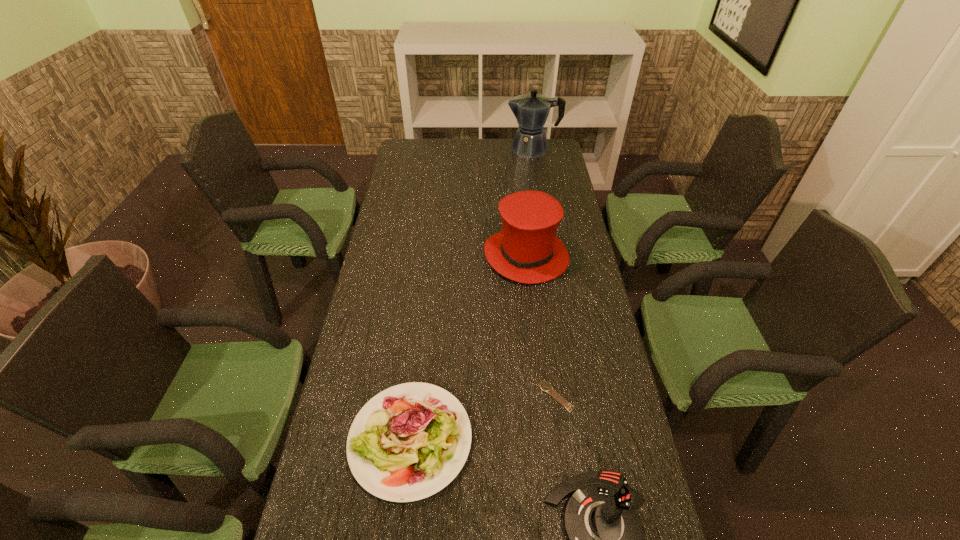
Locate an element on the screen. Image resolution: width=960 pixels, height=540 pixels. free space located on the back of the leftmost object is located at coordinates (420, 364).

Identify the location of vacant space positioned on the front of the watch. click(568, 491).

Where is `object present at the far edge`? object present at the far edge is located at coordinates (531, 110).

Image resolution: width=960 pixels, height=540 pixels. In order to click on object present at the left edge in this screenshot , I will do `click(408, 442)`.

Find the location of `coffeepot present at the right edge`. coffeepot present at the right edge is located at coordinates (531, 110).

Find the location of a particular element. The image size is (960, 540). hat that is at the right edge is located at coordinates (527, 250).

At what (x,y) coordinates should I click in order to perform the action: click on watch situated at the right edge. Please return your answer as a coordinate pair (x, y). This screenshot has width=960, height=540. Looking at the image, I should click on (545, 386).

Image resolution: width=960 pixels, height=540 pixels. I want to click on object at the far right corner, so click(531, 110).

In the image, there is a desktop. Identify the location of vacant area at the far edge. The height and width of the screenshot is (540, 960). (512, 143).

Where is `vacant region at the left edge`? vacant region at the left edge is located at coordinates (390, 187).